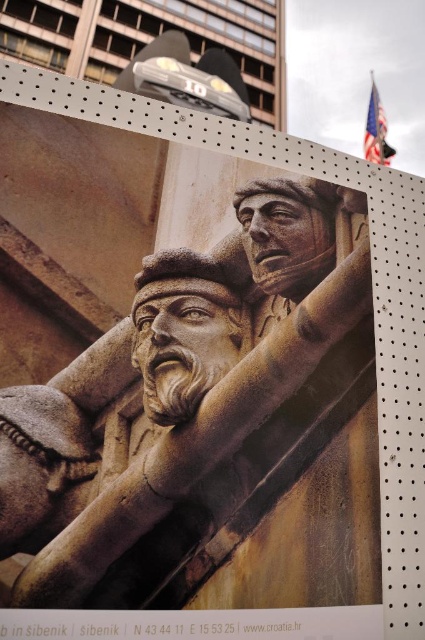
Which is more to the left, rustic stone sculpture at center or carved stone man at center?

Positioned to the left is carved stone man at center.

Who is positioned more to the right, rustic stone sculpture at center or carved stone man at center?

rustic stone sculpture at center is more to the right.

Is point (215, 296) less distant than point (193, 259)?

Yes, it is in front of point (193, 259).

Locate an element on the screen. The width and height of the screenshot is (425, 640). rustic stone sculpture at center is located at coordinates [209, 428].